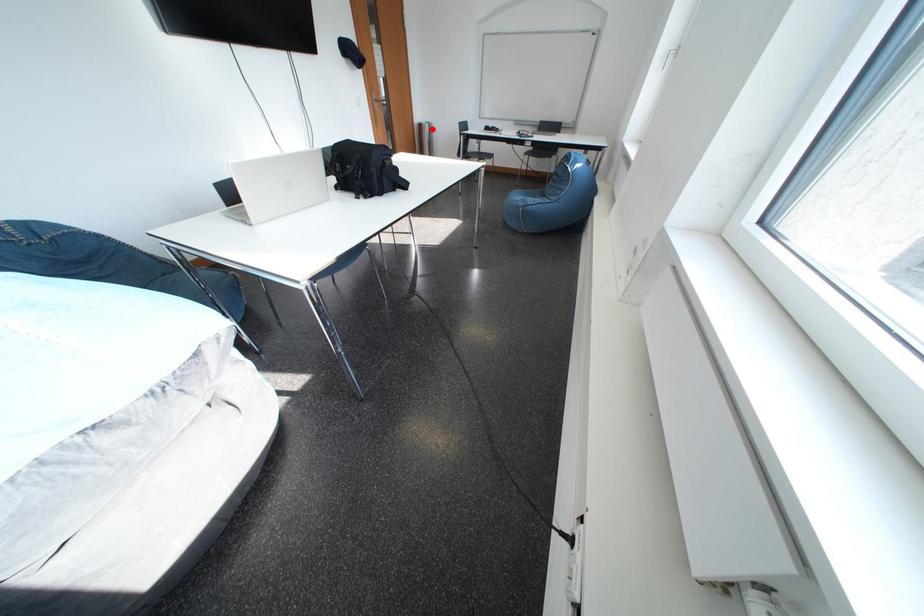
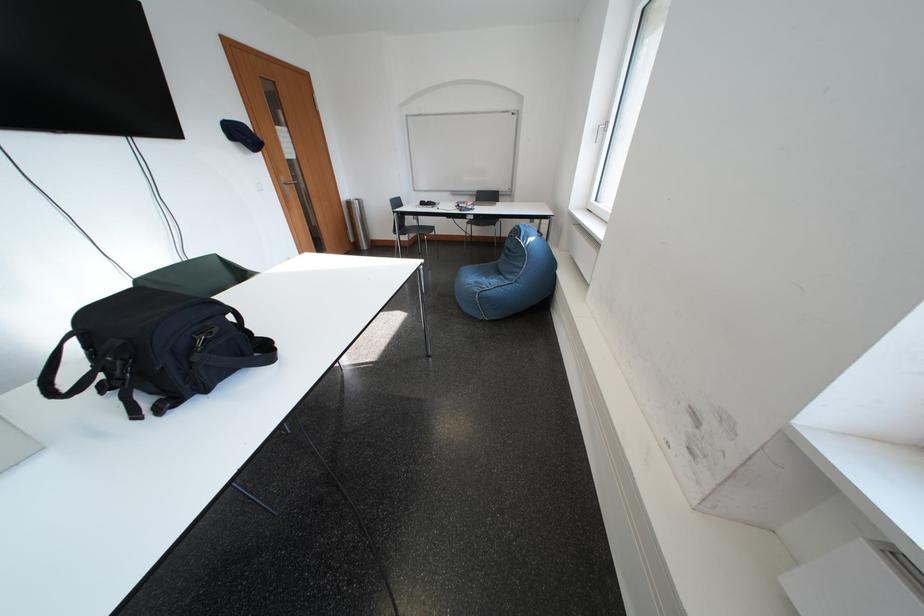
Locate, in the second image, the point that corresponds to the highlighted location in the first image.

(360, 207)